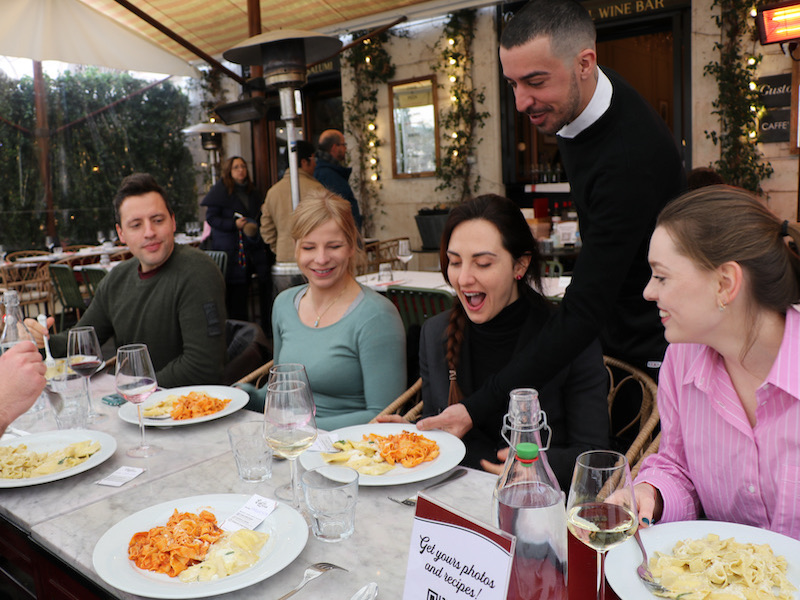
The width and height of the screenshot is (800, 600). I want to click on light gray table tops, so click(x=40, y=255), click(x=117, y=250), click(x=98, y=267), click(x=170, y=459), click(x=380, y=541), click(x=410, y=278), click(x=558, y=290).